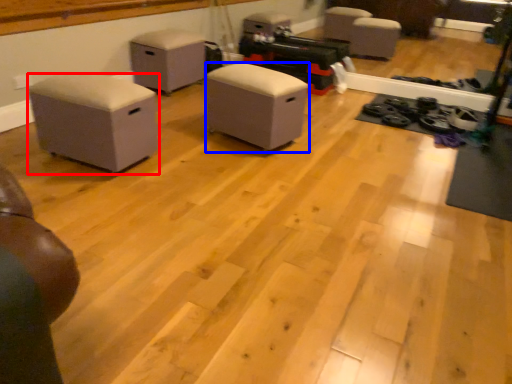
Question: Among these objects, which one is farthest to the camera, furniture (highlighted by a red box) or furniture (highlighted by a blue box)?

Choices:
 (A) furniture
 (B) furniture

Answer: (B)